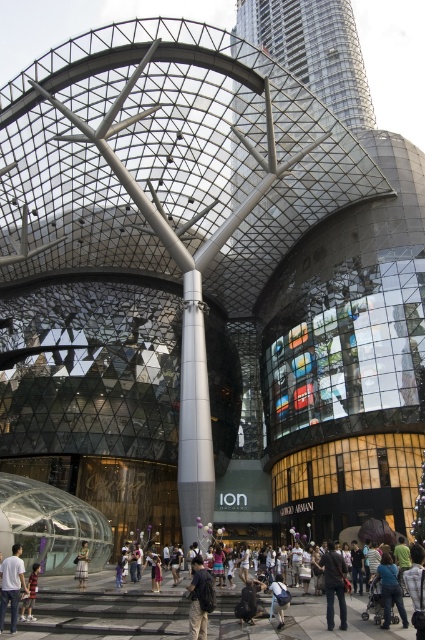
Question: Based on their relative distances, which object is farther from the denim jacket at center?

Choices:
 (A) light brown leather jacket at lower left
 (B) light brown leather jacket at center
 (C) white glossy pillar at center

Answer: (C)

Question: Which object appears closest to the camera in this image?

Choices:
 (A) light brown leather jacket at lower left
 (B) khaki pants at center
 (C) white glossy pillar at center

Answer: (B)

Question: Is dark brown leather jacket at center to the left of denim jacket at center from the viewer's perspective?

Choices:
 (A) no
 (B) yes

Answer: (A)

Question: Observing the image, what is the correct spatial positioning of glassy steel tower at upper center in reference to light brown leather jacket at center?

Choices:
 (A) right
 (B) left

Answer: (A)

Question: Which point is farther to the camera?

Choices:
 (A) white glossy pillar at center
 (B) light brown leather jacket at center
 (C) light brown leather jacket at lower left
 (D) dark brown leather jacket at center

Answer: (A)

Question: Is khaki pants at center smaller than light brown leather jacket at lower left?

Choices:
 (A) no
 (B) yes

Answer: (A)